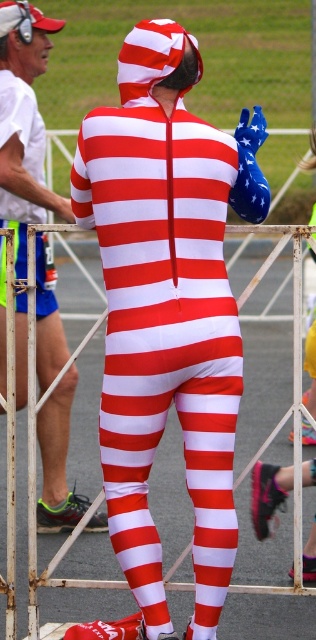
Which is above, matte red and white striped suit at center or smooth asphalt race track at center?

matte red and white striped suit at center

Is matte red and white striped suit at center wider than smooth asphalt race track at center?

Indeed, matte red and white striped suit at center has a greater width compared to smooth asphalt race track at center.

Describe the element at coordinates (168, 307) in the screenshot. I see `matte red and white striped suit at center` at that location.

You are a GUI agent. You are given a task and a screenshot of the screen. Output one action in this format:
    pyautogui.click(x=<x>, y=<y>)
    Task: Click on the matte red and white striped suit at center
    
    Given the screenshot: What is the action you would take?
    pyautogui.click(x=168, y=307)

Which of these two, matte red-white striped suit at center or smooth asphalt race track at center, stands taller?

matte red-white striped suit at center is taller.

Which is in front, point (36, 237) or point (32, 538)?

Positioned in front is point (32, 538).

Identify the location of matte red-white striped suit at center. (24, 124).

Who is positioned more to the left, matte red and white striped suit at center or matte red-white striped suit at center?

Positioned to the left is matte red-white striped suit at center.

Identify the location of matte red and white striped suit at center. (168, 307).

This screenshot has width=316, height=640. In order to click on matte red and white striped suit at center in this screenshot , I will do `click(168, 307)`.